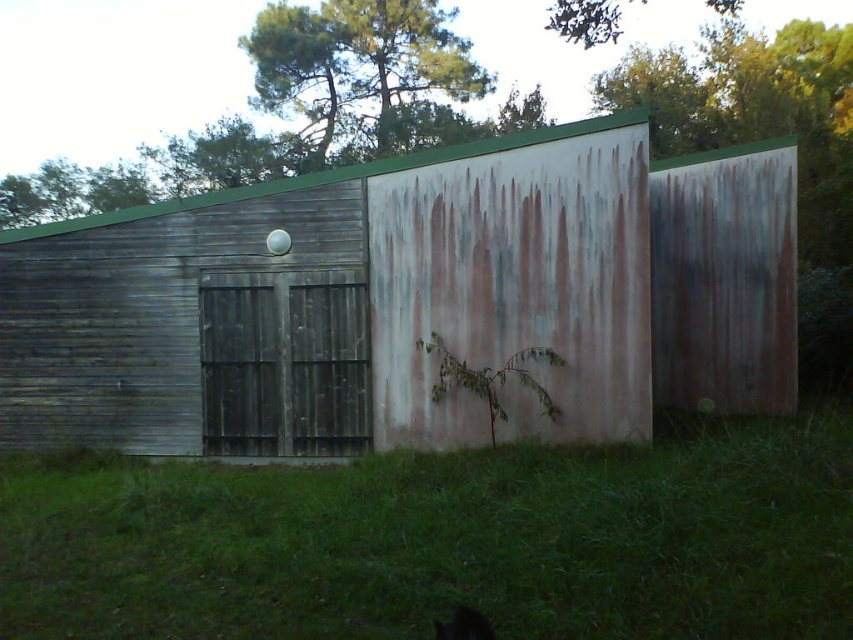
Question: Is rusty metal barn at center closer to camera compared to green leafy tree at upper center?

Choices:
 (A) no
 (B) yes

Answer: (B)

Question: Among these objects, which one is farthest from the camera?

Choices:
 (A) green leafy tree at upper center
 (B) rusty metal barn at center

Answer: (A)

Question: From the image, what is the correct spatial relationship of green grass at lower center in relation to green leafy tree at upper center?

Choices:
 (A) below
 (B) above

Answer: (A)

Question: Is rusty metal barn at center to the left of green leafy tree at upper center from the viewer's perspective?

Choices:
 (A) yes
 (B) no

Answer: (B)

Question: Estimate the real-world distances between objects in this image. Which object is farther from the green grass at lower center?

Choices:
 (A) green leafy tree at upper center
 (B) rusty metal barn at center

Answer: (A)

Question: Estimate the real-world distances between objects in this image. Which object is closer to the rusty metal barn at center?

Choices:
 (A) green grass at lower center
 (B) green leafy tree at upper center

Answer: (A)